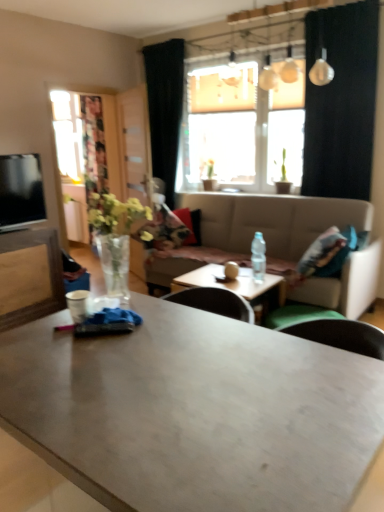
Locate an element on the screen. green matte plant at upper center is located at coordinates (210, 177).

Describe the element at coordinates (341, 102) in the screenshot. I see `black fabric curtain at upper right, which is the first curtain from front to back` at that location.

Describe the element at coordinates (21, 191) in the screenshot. The image size is (384, 512). I see `matte black television at left` at that location.

Locate an element on the screen. matte black television at left is located at coordinates (21, 191).

Describe the element at coordinates (194, 412) in the screenshot. This screenshot has width=384, height=512. I see `matte gray coffee table at center, which is counted as the first coffee table, starting from the front` at that location.

Looking at this image, what is the approximate height of matte gray coffee table at center, the 2th coffee table from the back?

It is 35.42 inches.

Find the location of a particular element. Image resolution: width=384 pixels, height=512 pixels. beige fabric couch at center is located at coordinates (270, 223).

Image resolution: width=384 pixels, height=512 pixels. Describe the element at coordinates (270, 223) in the screenshot. I see `beige fabric couch at center` at that location.

Locate an element on the screen. The height and width of the screenshot is (512, 384). green matte plant at upper center is located at coordinates (210, 177).

Is beige fabric couch at center inside clear glass vase at left?

Actually, beige fabric couch at center is outside clear glass vase at left.

Considering the sizes of objects clear glass vase at left and beige fabric couch at center in the image provided, who is thinner, clear glass vase at left or beige fabric couch at center?

clear glass vase at left.

From the image's perspective, who appears lower, clear glass vase at left or beige fabric couch at center?

From the image's view, beige fabric couch at center is below.

Is clear glass vase at left oriented away from beige fabric couch at center?

No, clear glass vase at left's orientation is not away from beige fabric couch at center.

From a real-world perspective, between transparent glass door at left and wooden table at center, the second coffee table from the front, who is vertically higher?

transparent glass door at left is physically above.

Is transparent glass door at left positioned beyond the bounds of wooden table at center, the second coffee table from the front?

transparent glass door at left is positioned outside wooden table at center, the second coffee table from the front.

Is transparent glass door at left oriented away from wooden table at center, arranged as the first coffee table when viewed from the back?

That's not correct — transparent glass door at left is not looking away from wooden table at center, arranged as the first coffee table when viewed from the back.

Considering the positions of objects transparent glass door at left and wooden table at center, the second coffee table from the front, in the image provided, who is behind, transparent glass door at left or wooden table at center, the second coffee table from the front,?

transparent glass door at left.

Looking at their sizes, would you say transparent glass door at left is wider or thinner than clear glass vase at left?

In the image, transparent glass door at left appears to be more narrow than clear glass vase at left.

Considering their positions, is transparent glass door at left located in front of or behind clear glass vase at left?

transparent glass door at left is behind clear glass vase at left.

Between transparent glass door at left and clear glass vase at left, which one has larger size?

With larger size is transparent glass door at left.

From a real-world perspective, which is physically below, transparent glass door at left or clear glass vase at left?

From a 3D spatial view, clear glass vase at left is below.

Where is `entertainment center beneath the black fabric curtain at upper right, which is the first curtain from front to back (from a real-world perspective)`? The image size is (384, 512). entertainment center beneath the black fabric curtain at upper right, which is the first curtain from front to back (from a real-world perspective) is located at coordinates (26, 246).

Would you say wooden entertainment center at left is outside black fabric curtain at upper right, the first curtain positioned from the right?

Yes, wooden entertainment center at left is outside of black fabric curtain at upper right, the first curtain positioned from the right.

Is wooden entertainment center at left facing towards black fabric curtain at upper right, the 2th curtain when ordered from left to right?

No, wooden entertainment center at left is not aimed at black fabric curtain at upper right, the 2th curtain when ordered from left to right.

Which object is positioned more to the right, wooden entertainment center at left or matte gray coffee table at center, which is counted as the first coffee table, starting from the front?

Positioned to the right is matte gray coffee table at center, which is counted as the first coffee table, starting from the front.

From a real-world perspective, is wooden entertainment center at left below matte gray coffee table at center, which is counted as the first coffee table, starting from the front?

Yes, from a real-world perspective, wooden entertainment center at left is below matte gray coffee table at center, which is counted as the first coffee table, starting from the front.

Is wooden entertainment center at left located outside matte gray coffee table at center, which is counted as the first coffee table, starting from the front?

wooden entertainment center at left is positioned outside matte gray coffee table at center, which is counted as the first coffee table, starting from the front.

Is transparent glass door at left facing away from wooden entertainment center at left?

No, transparent glass door at left's orientation is not away from wooden entertainment center at left.

Would you say transparent glass door at left is inside or outside wooden entertainment center at left?

transparent glass door at left is not inside wooden entertainment center at left, it's outside.

What's the angular difference between transparent glass door at left and wooden entertainment center at left's facing directions?

The facing directions of transparent glass door at left and wooden entertainment center at left are 114 degrees apart.

From the image's perspective, is transparent glass door at left on top of wooden entertainment center at left?

Correct, transparent glass door at left appears higher than wooden entertainment center at left in the image.

In the image, is matte black television at left positioned in front of or behind matte gray coffee table at center, the 2th coffee table from the back?

In the image, matte black television at left appears behind matte gray coffee table at center, the 2th coffee table from the back.

Does matte black television at left have a larger size compared to matte gray coffee table at center, which is counted as the first coffee table, starting from the front?

Actually, matte black television at left might be smaller than matte gray coffee table at center, which is counted as the first coffee table, starting from the front.

Is matte black television at left facing away from matte gray coffee table at center, which is counted as the first coffee table, starting from the front?

No, matte gray coffee table at center, which is counted as the first coffee table, starting from the front, is not at the back of matte black television at left.

Is matte black television at left to the right of matte gray coffee table at center, which is counted as the first coffee table, starting from the front, from the viewer's perspective?

No, matte black television at left is not to the right of matte gray coffee table at center, which is counted as the first coffee table, starting from the front.

Where is `glass vase in front of the beige fabric couch at center`? The width and height of the screenshot is (384, 512). glass vase in front of the beige fabric couch at center is located at coordinates (116, 261).

From a real-world perspective, starting from the transparent glass door at left, which coffee table is the 2nd one below it? Please provide its 2D coordinates.

[(234, 283)]

Estimate the real-world distances between objects in this image. Which object is further from green matte plant at upper center, beige fabric couch at center or clear plastic bottle at table center?

Based on the image, clear plastic bottle at table center appears to be further to green matte plant at upper center.

When comparing their distances from wooden entertainment center at left, does translucent glass window at center or clear plastic bottle at table center seem closer?

The object closer to wooden entertainment center at left is clear plastic bottle at table center.

Which object lies further to the anchor point wooden table at center, arranged as the first coffee table when viewed from the back, wooden entertainment center at left or green matte plant at upper center?

green matte plant at upper center is positioned further to the anchor wooden table at center, arranged as the first coffee table when viewed from the back.

Looking at the image, which one is located closer to green matte plant at upper center, translucent glass window at center or clear glass vase at left?

translucent glass window at center is positioned closer to the anchor green matte plant at upper center.

Estimate the real-world distances between objects in this image. Which object is further from black fabric curtain at upper right, the first curtain positioned from the right, black fabric curtain at upper center, which ranks as the first curtain in back-to-front order, or wooden table at center, the second coffee table from the front?

black fabric curtain at upper center, which ranks as the first curtain in back-to-front order, is positioned further to the anchor black fabric curtain at upper right, the first curtain positioned from the right.

Estimate the real-world distances between objects in this image. Which object is closer to wooden entertainment center at left, beige fabric couch at center or transparent glass door at left?

Based on the image, transparent glass door at left appears to be nearer to wooden entertainment center at left.

Considering their positions, is clear plastic bottle at table center positioned closer to beige fabric couch at center than transparent glass door at left?

Based on the image, clear plastic bottle at table center appears to be nearer to beige fabric couch at center.

Estimate the real-world distances between objects in this image. Which object is further from matte gray coffee table at center, which is counted as the first coffee table, starting from the front, beige fabric couch at center or wooden entertainment center at left?

beige fabric couch at center.

Locate an element on the screen. Image resolution: width=384 pixels, height=512 pixels. curtain between black fabric curtain at upper center, acting as the 2th curtain starting from the right, and wooden table at center, arranged as the first coffee table when viewed from the back, from top to bottom is located at coordinates (341, 102).

The image size is (384, 512). Identify the location of television between wooden entertainment center at left and beige fabric couch at center. pyautogui.click(x=21, y=191).

Image resolution: width=384 pixels, height=512 pixels. In order to click on studio couch located between clear glass vase at left and black fabric curtain at upper center, acting as the 2th curtain starting from the right, in the depth direction in this screenshot , I will do `click(270, 223)`.

At what (x,y) coordinates should I click in order to perform the action: click on coffee table between clear glass vase at left and matte black television at left along the z-axis. Please return your answer as a coordinate pair (x, y). The image size is (384, 512). Looking at the image, I should click on (234, 283).